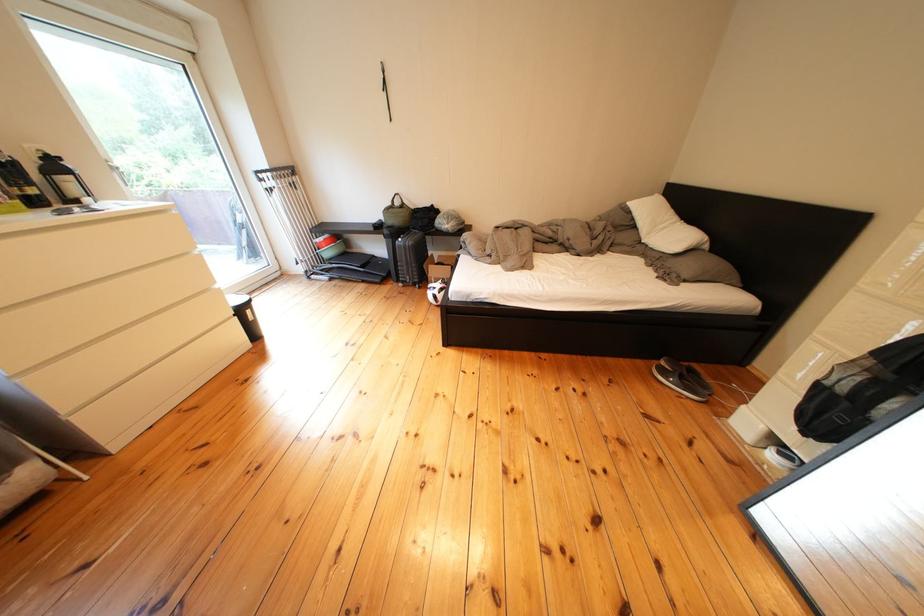
Where is `white drawer front`? Image resolution: width=924 pixels, height=616 pixels. white drawer front is located at coordinates (104, 323).